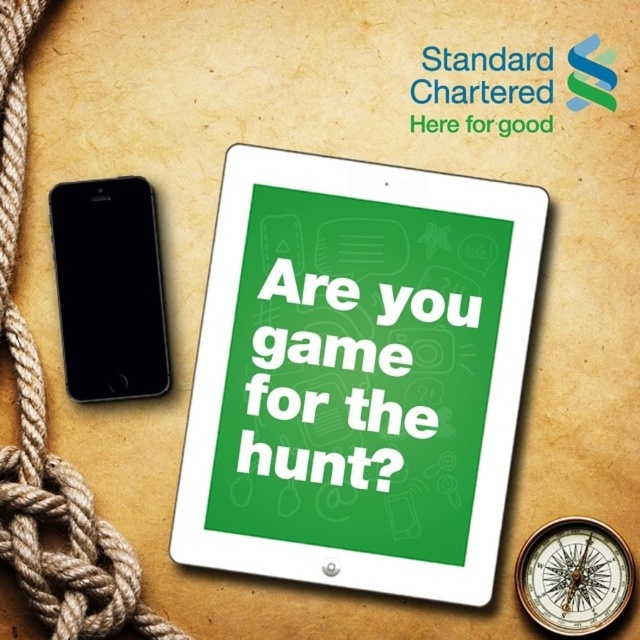
Question: Can you confirm if brown rope at left is thinner than green matte poster at center?

Choices:
 (A) yes
 (B) no

Answer: (A)

Question: Can you confirm if brown rope at left is positioned below green matte poster at center?

Choices:
 (A) yes
 (B) no

Answer: (B)

Question: Estimate the real-world distances between objects in this image. Which object is closer to the green matte poster at center?

Choices:
 (A) black glass smartphone at left
 (B) brown rope at left

Answer: (A)

Question: Among these points, which one is farthest from the camera?

Choices:
 (A) (92, 243)
 (B) (28, 532)
 (C) (448, 209)
 (D) (390, 420)

Answer: (D)

Question: Observing the image, what is the correct spatial positioning of brown rope at left in reference to black glass smartphone at left?

Choices:
 (A) above
 (B) below

Answer: (B)

Question: Which of these objects is positioned farthest from the black glass smartphone at left?

Choices:
 (A) brown rope at left
 (B) green glossy tablet at center
 (C) green matte poster at center

Answer: (B)